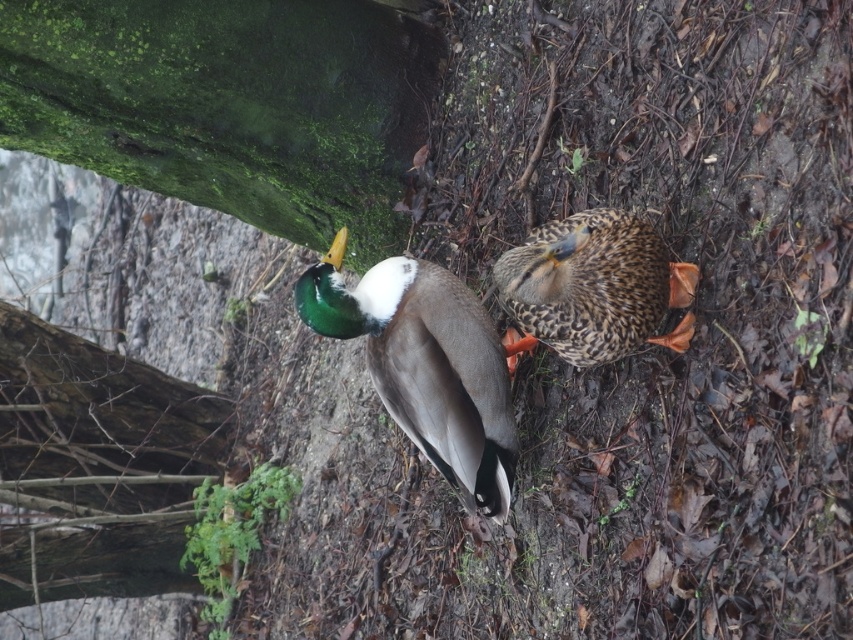
You are a birdwatcher observing the scene. You notice the green mossy tree trunk at upper left and the green glossy duck at center. Which object is closer to the left edge of the image?

The green mossy tree trunk at upper left is closer to the left edge of the image because it is positioned on the left side of the green glossy duck at center.

You are a wildlife photographer aiming to capture both the green glossy duck at center and the speckled feathered duck at center in a single frame. Which duck should you focus on first to ensure both are in the shot?

The green glossy duck at center is taller than the speckled feathered duck at center, so you should focus on the green glossy duck at center first to ensure both are in the shot.

You are a birdwatcher observing the scene. You notice the green mossy tree trunk at upper left and the green glossy duck at center. Which object is wider?

The green mossy tree trunk at upper left is wider than the green glossy duck at center.